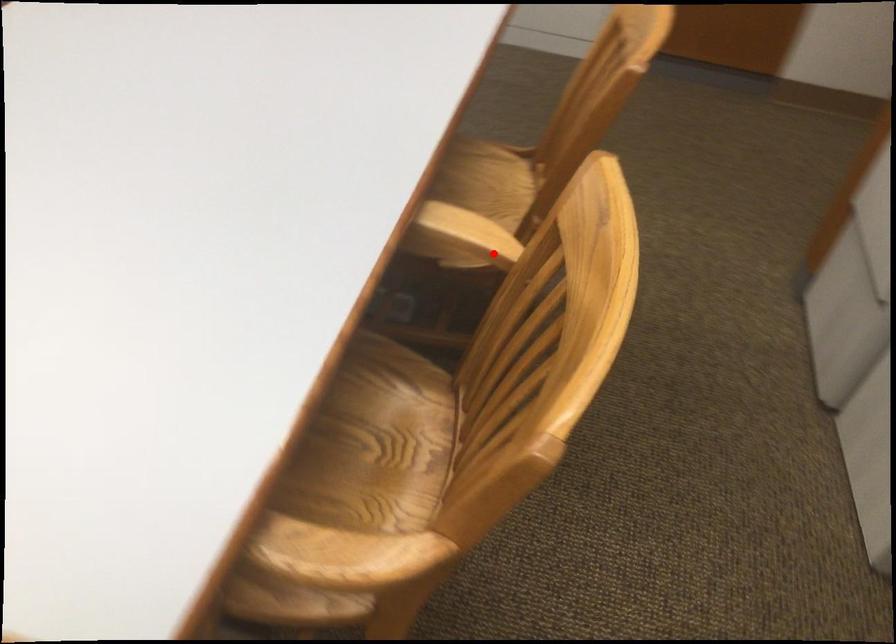
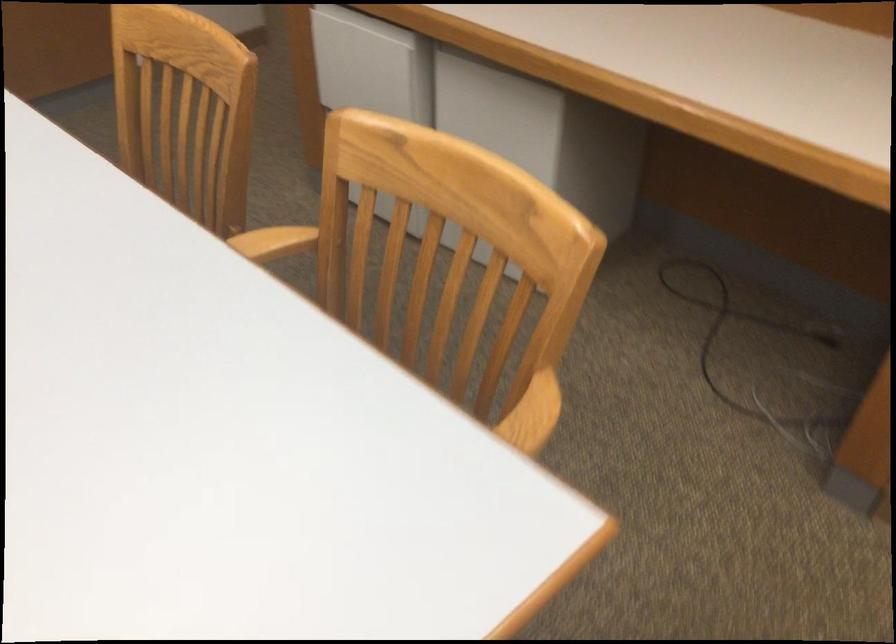
Find the pixel in the second image that matches the highlighted location in the first image.

(293, 241)